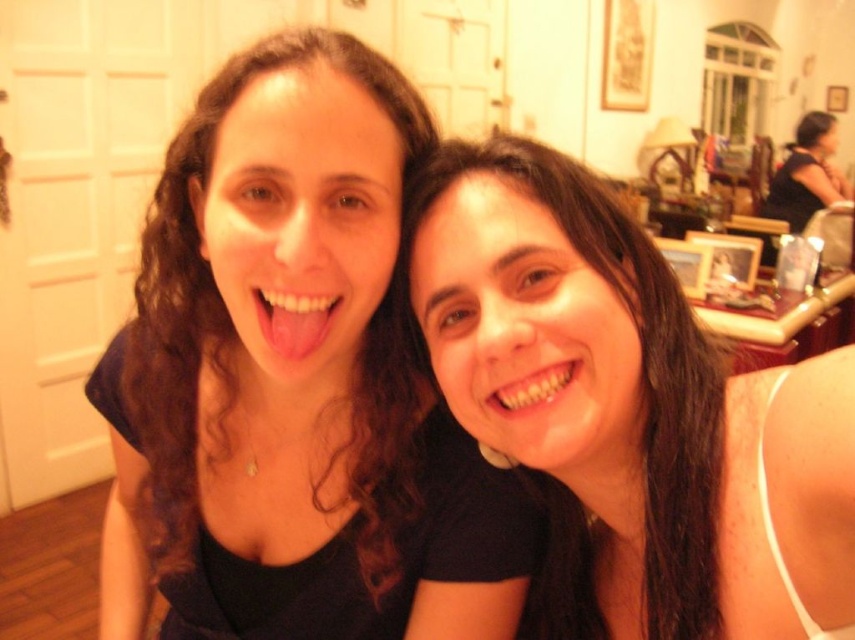
You are a photographer adjusting the lighting in this indoor scene. You notice the matte black hair at center and the white glossy teeth at center. Which object should you focus your light on to highlight the contrast between them?

The white glossy teeth at center should be the focus because they are positioned above the matte black hair at center, making them more prominent in the frame.

You are a photographer trying to capture a closeup shot of the two people in the image. You need to ensure that both the matte black hair at center and the white glossy teeth at center are in focus. Given that your camera can only focus on objects within a 10 cm width range, can you determine if both objects can be in focus at the same time?

The matte black hair at center might be wider than white glossy teeth at center, but since the camera can focus on objects within a 10 cm width range, it depends on their actual width. However, without exact measurements, it is uncertain if both can be in focus simultaneously.